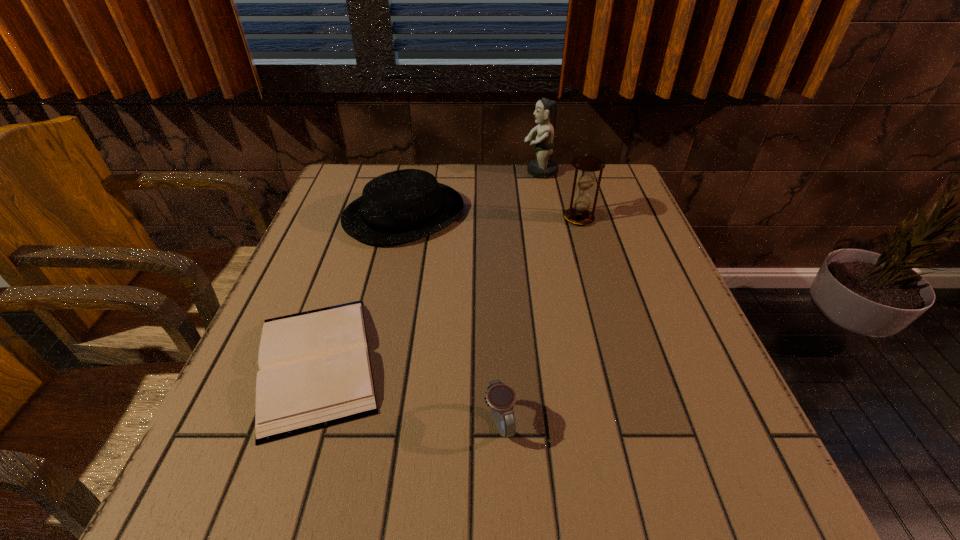
Locate an element on the screen. The image size is (960, 540). figurine is located at coordinates (542, 167).

Locate an element on the screen. the farthest object is located at coordinates [542, 167].

The image size is (960, 540). What are the coordinates of `hourglass` in the screenshot? It's located at (581, 200).

I want to click on the third tallest object, so click(x=405, y=205).

This screenshot has width=960, height=540. Find the location of `the second shortest object`. the second shortest object is located at coordinates (501, 398).

This screenshot has width=960, height=540. Identify the location of the third object from left to right. (501, 398).

At what (x,y) coordinates should I click in order to perform the action: click on the shortest object. Please return your answer as a coordinate pair (x, y). The width and height of the screenshot is (960, 540). Looking at the image, I should click on (315, 371).

Where is `blank area located on the front-facing side of the figurine`? Image resolution: width=960 pixels, height=540 pixels. blank area located on the front-facing side of the figurine is located at coordinates (434, 172).

I want to click on free space located 0.180m on the front-facing side of the figurine, so click(x=461, y=172).

This screenshot has width=960, height=540. I want to click on vacant space located 0.270m on the front-facing side of the figurine, so click(x=431, y=172).